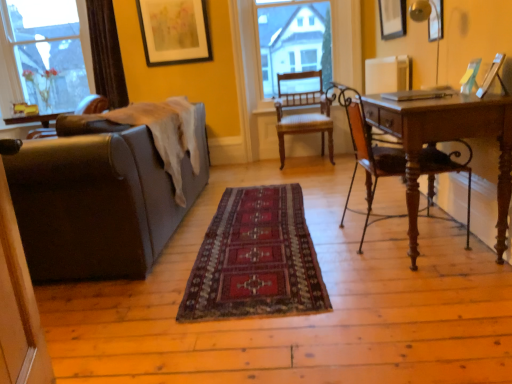
Question: From the image's perspective, is metallic gold picture frame at upper right, which is the 2th picture frame from right to left, under clear glass window at upper left?

Choices:
 (A) no
 (B) yes

Answer: (B)

Question: Is the depth of metallic gold picture frame at upper right, the third picture frame from the back, greater than that of clear glass window at upper left?

Choices:
 (A) yes
 (B) no

Answer: (B)

Question: From a real-world perspective, is metallic gold picture frame at upper right, the 2th picture frame positioned from the left, below clear glass window at upper left?

Choices:
 (A) no
 (B) yes

Answer: (B)

Question: From a real-world perspective, is metallic gold picture frame at upper right, which is the 1th picture frame in front-to-back order, positioned over clear glass window at upper left based on gravity?

Choices:
 (A) no
 (B) yes

Answer: (A)

Question: Is metallic gold picture frame at upper right, which is the 1th picture frame in front-to-back order, oriented away from clear glass window at upper left?

Choices:
 (A) no
 (B) yes

Answer: (A)

Question: Would you consider metallic gold picture frame at upper right, which is the 1th picture frame in front-to-back order, to be distant from clear glass window at upper left?

Choices:
 (A) yes
 (B) no

Answer: (A)

Question: Is transparent glass chair at upper center beside brown leather couch at left?

Choices:
 (A) no
 (B) yes

Answer: (A)

Question: Can you confirm if transparent glass chair at upper center is bigger than brown leather couch at left?

Choices:
 (A) yes
 (B) no

Answer: (B)

Question: Would you say transparent glass chair at upper center is a long distance from brown leather couch at left?

Choices:
 (A) no
 (B) yes

Answer: (B)

Question: Considering the relative positions of transparent glass chair at upper center and brown leather couch at left in the image provided, is transparent glass chair at upper center to the left of brown leather couch at left from the viewer's perspective?

Choices:
 (A) no
 (B) yes

Answer: (A)

Question: From a real-world perspective, is transparent glass chair at upper center located beneath brown leather couch at left?

Choices:
 (A) yes
 (B) no

Answer: (B)

Question: Considering the relative sizes of transparent glass chair at upper center and brown leather couch at left in the image provided, is transparent glass chair at upper center smaller than brown leather couch at left?

Choices:
 (A) yes
 (B) no

Answer: (A)

Question: Considering the relative positions of white matte radiator at upper right and brown leather couch at left in the image provided, is white matte radiator at upper right to the left of brown leather couch at left from the viewer's perspective?

Choices:
 (A) yes
 (B) no

Answer: (B)